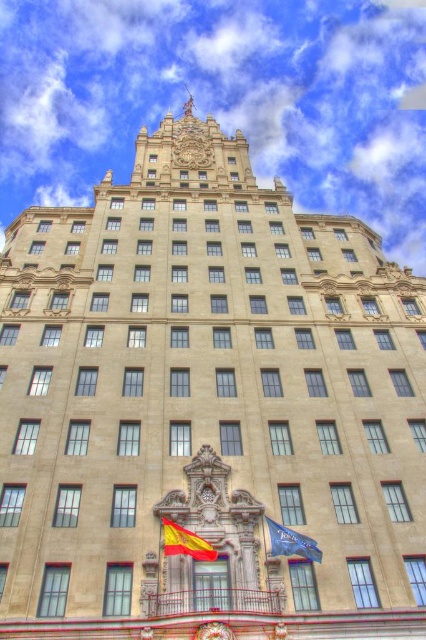
You are an architect reviewing a design for a building with two flags. The design shows a red fabric flag at center and a blue fabric flag at center. According to the design, which flag has a greater width?

The red fabric flag at center has a greater width than the blue fabric flag at center according to the design description.

You are a tourist visiting the building and want to take a photo that includes both the red fabric flag at center and the blue fabric flag at center. Since you are standing at the base of the building, which flag will appear taller in your photo?

The red fabric flag at center will appear taller in the photo because it has a greater height compared to the blue fabric flag at center.

You are standing in front of the grand building and notice a flag at point (184,541). What color is the flag?

The flag at point (184,541) is red fabric flag at center, so the flag is red.